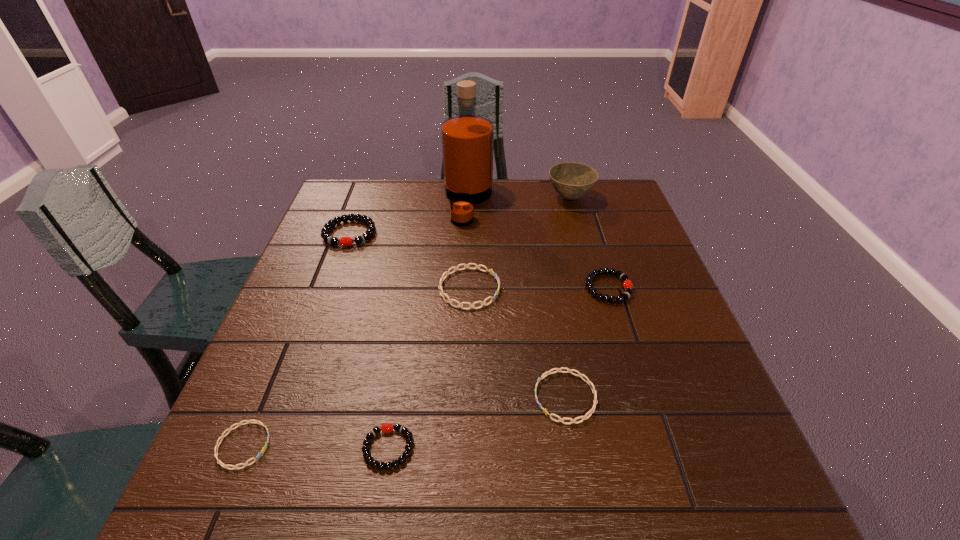
You are a GUI agent. You are given a task and a screenshot of the screen. Output one action in this format:
    pyautogui.click(x=<x>, y=<y>)
    Task: Click on the tallest object
    Image resolution: width=960 pixels, height=540 pixels.
    Given the screenshot: What is the action you would take?
    pyautogui.click(x=467, y=139)

Identify the location of bowl. (571, 180).

The image size is (960, 540). In order to click on the leftmost black bracelet in this screenshot , I will do `click(325, 231)`.

The height and width of the screenshot is (540, 960). I want to click on the biggest black bracelet, so click(325, 231).

Identify the location of the farthest blue bracelet. Image resolution: width=960 pixels, height=540 pixels. (447, 273).

Image resolution: width=960 pixels, height=540 pixels. I want to click on the second blue bracelet from left to right, so click(447, 273).

Find the location of a particular element. the rightmost bracelet is located at coordinates (627, 284).

Where is `the second nearest black bracelet`? Image resolution: width=960 pixels, height=540 pixels. the second nearest black bracelet is located at coordinates (627, 284).

The height and width of the screenshot is (540, 960). Find the location of `the fifth bracelet from left to right`. the fifth bracelet from left to right is located at coordinates (588, 381).

Image resolution: width=960 pixels, height=540 pixels. I want to click on the second biggest blue bracelet, so click(x=588, y=381).